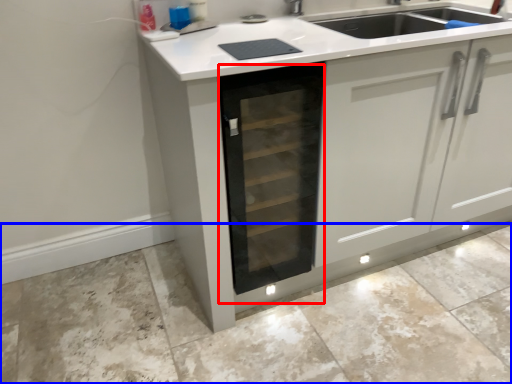
Question: Among these objects, which one is nearest to the camera, oven (highlighted by a red box) or granite (highlighted by a blue box)?

Choices:
 (A) oven
 (B) granite

Answer: (B)